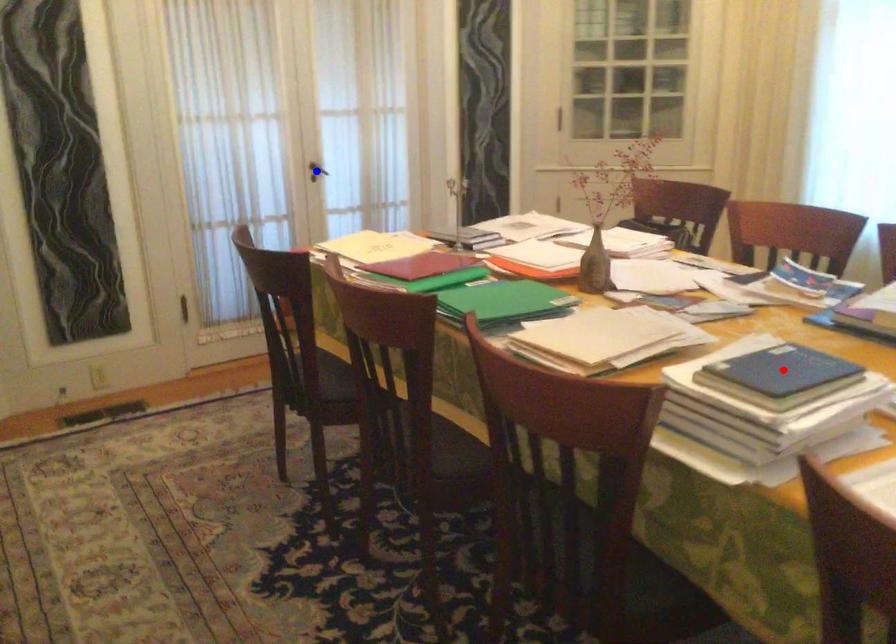
Question: Which of the two points in the image is closer to the camera?

Choices:
 (A) Blue point is closer.
 (B) Red point is closer.

Answer: (B)